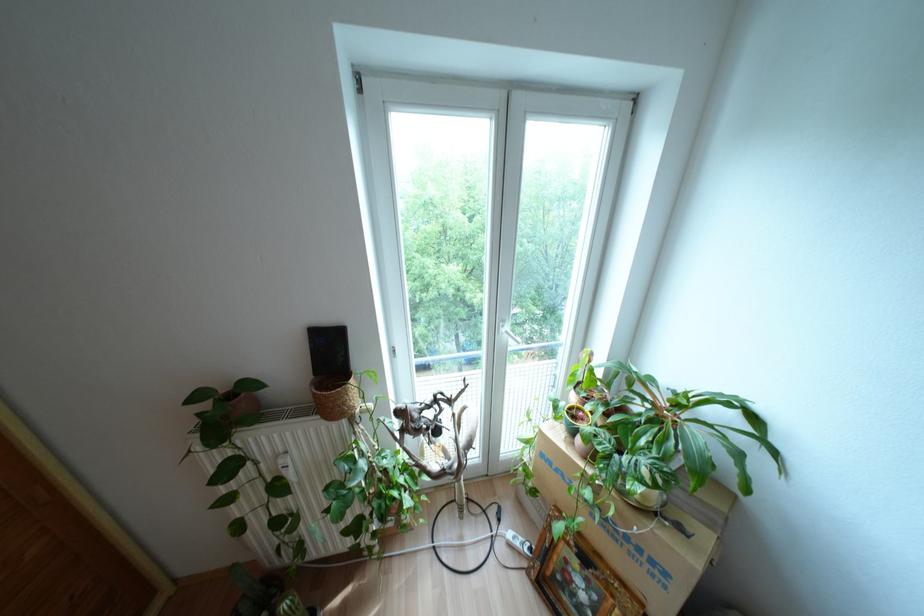
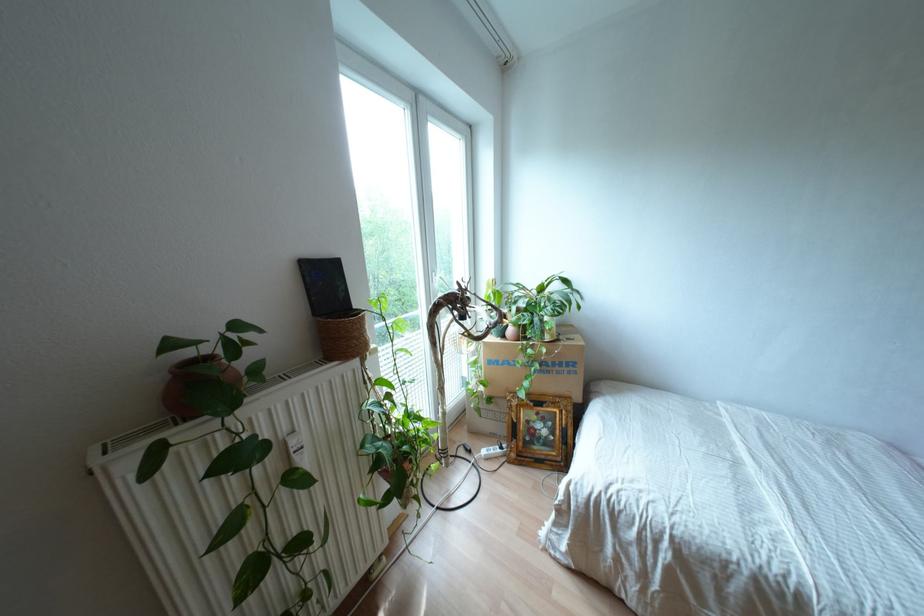
In the second image, find the point that corresponds to the point at 569,569 in the first image.

(530, 424)